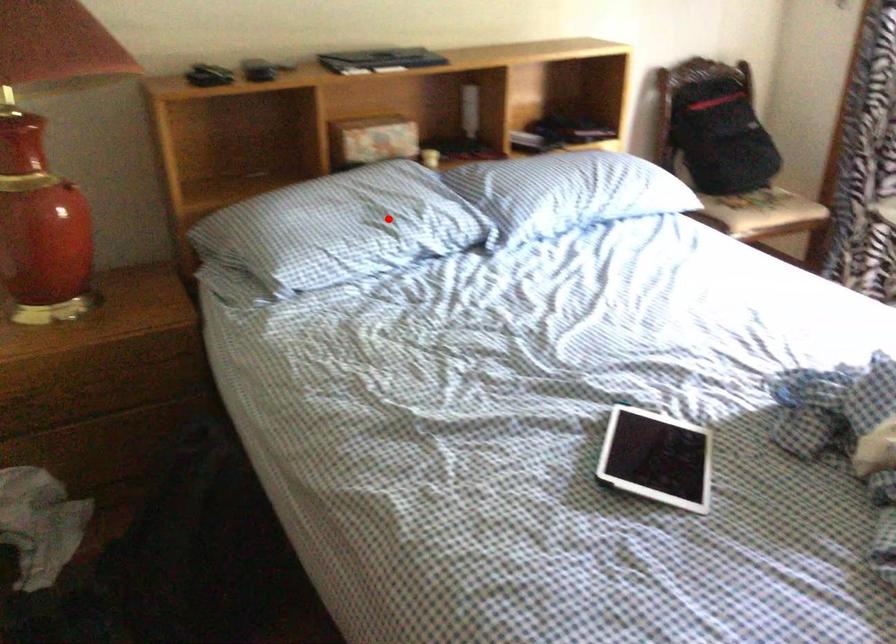
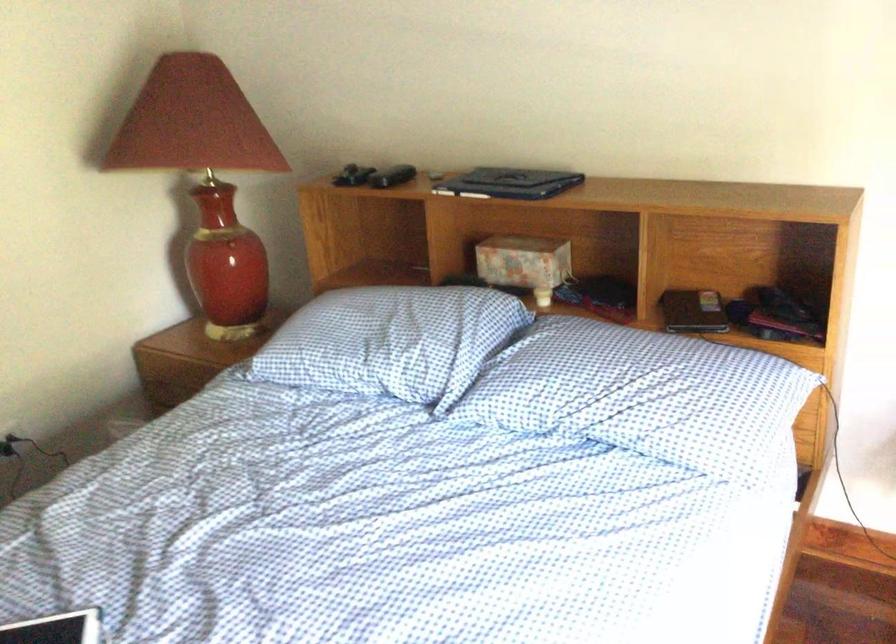
In the second image, find the point that corresponds to the highlighted location in the first image.

(384, 342)